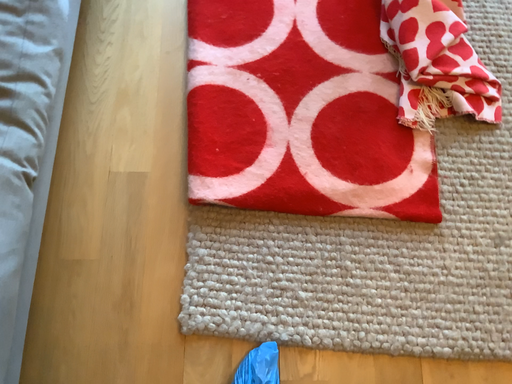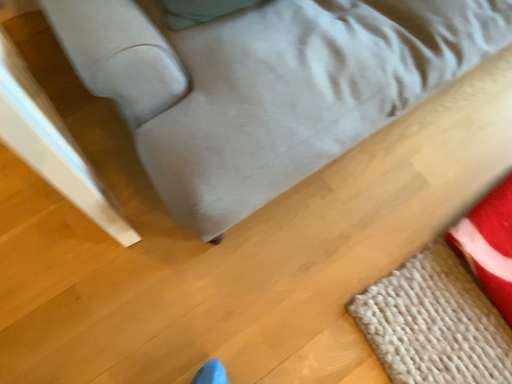
Question: How did the camera likely rotate when shooting the video?

Choices:
 (A) rotated downward
 (B) rotated upward

Answer: (B)